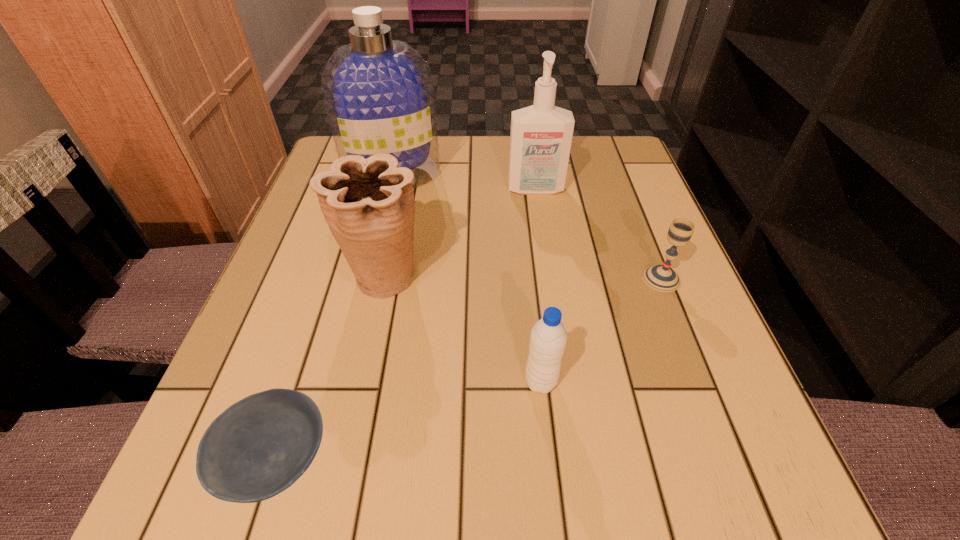
This screenshot has width=960, height=540. I want to click on free space in the image that satisfies the following two spatial constraints: 1. on the front side of the second shortest object; 2. on the right side of the urn, so pos(383,279).

Find the location of a particular element. The image size is (960, 540). vacant region that satisfies the following two spatial constraints: 1. on the back side of the fifth tallest object; 2. on the right side of the shortest object is located at coordinates (334, 279).

At what (x,y) coordinates should I click in order to perform the action: click on vacant space that satisfies the following two spatial constraints: 1. on the front side of the taller cleansing agent; 2. on the right side of the second nearest object. Please return your answer as a coordinate pair (x, y). Image resolution: width=960 pixels, height=540 pixels. Looking at the image, I should click on (342, 382).

In order to click on vacant point that satisfies the following two spatial constraints: 1. on the back side of the bowl; 2. on the left side of the fourth tallest object in this screenshot , I will do `click(301, 382)`.